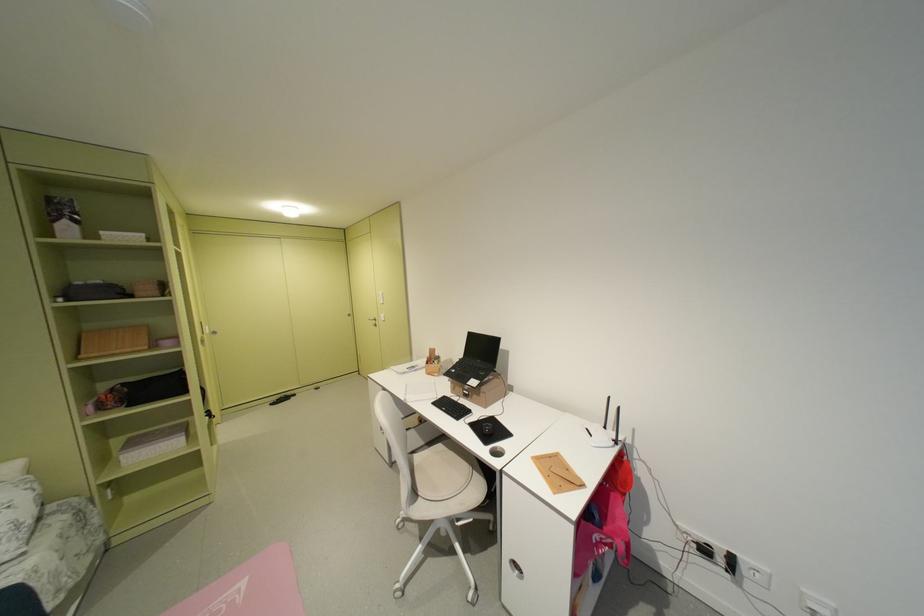
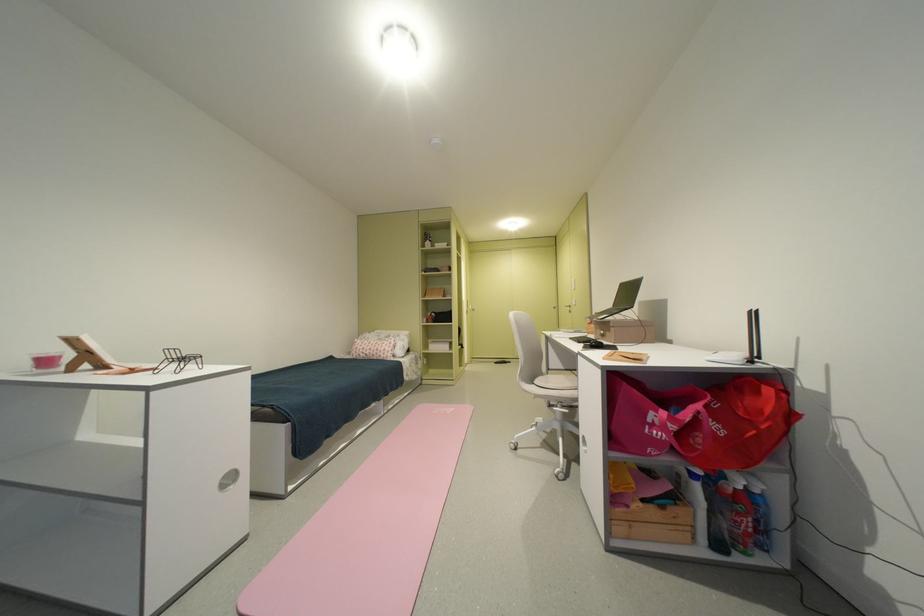
The point at (488, 397) is marked in the first image. Where is the corresponding point in the second image?

(618, 331)